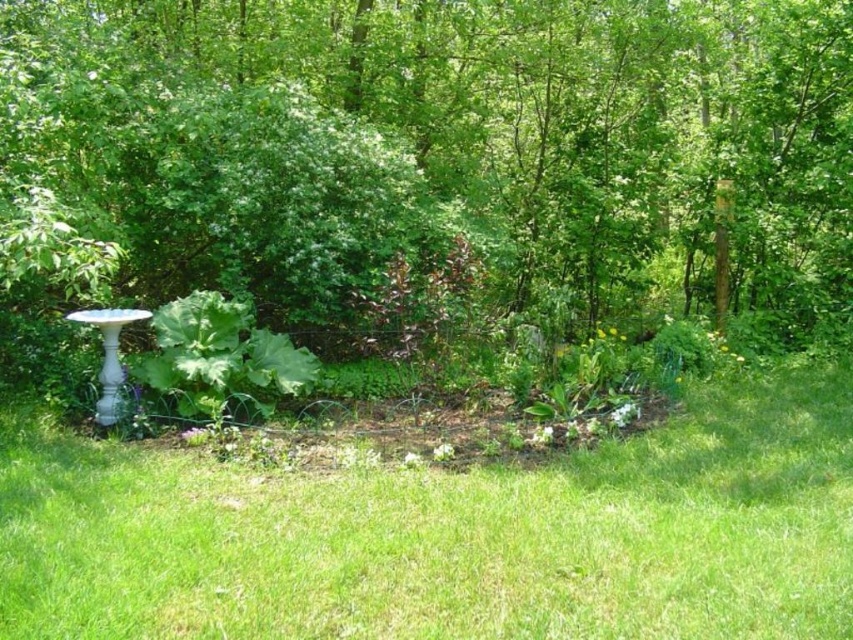
Is point (695, 227) positioned before point (403, 566)?

No, it is behind (403, 566).

Is green leafy tree at center taller than green grass at lower center?

In fact, green leafy tree at center may be shorter than green grass at lower center.

The image size is (853, 640). I want to click on green leafy tree at center, so click(x=447, y=144).